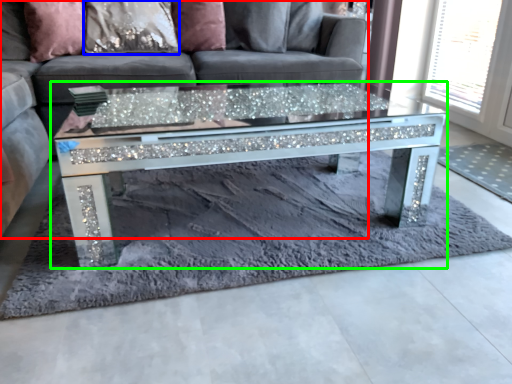
Question: Based on their relative distances, which object is nearer to studio couch (highlighted by a red box)? Choose from pillow (highlighted by a blue box) and coffee table (highlighted by a green box).

Choices:
 (A) pillow
 (B) coffee table

Answer: (A)